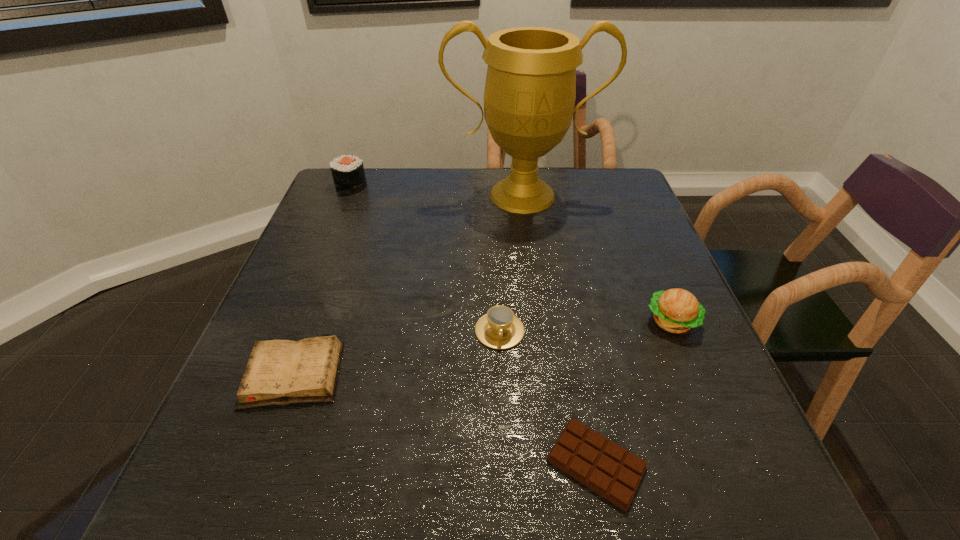
The width and height of the screenshot is (960, 540). I want to click on the tallest object, so click(x=529, y=97).

Locate an element on the screen. The width and height of the screenshot is (960, 540). sushi is located at coordinates (348, 173).

At what (x,y) coordinates should I click in order to perform the action: click on hamburger. Please return your answer as a coordinate pair (x, y). Looking at the image, I should click on (676, 310).

Find the location of a particular element. The height and width of the screenshot is (540, 960). cup is located at coordinates (500, 329).

You are a GUI agent. You are given a task and a screenshot of the screen. Output one action in this format:
    pyautogui.click(x=<x>, y=<y>)
    Task: Click on the diary
    The width and height of the screenshot is (960, 540).
    Given the screenshot: What is the action you would take?
    pyautogui.click(x=279, y=372)

I want to click on candy bar, so click(608, 469).

Image resolution: width=960 pixels, height=540 pixels. Identify the location of the shortest object. (608, 469).

At what (x,y) coordinates should I click in order to perform the action: click on vacant space located on the engravings side of the tallest object. Please return your answer as a coordinate pair (x, y). This screenshot has width=960, height=540. Looking at the image, I should click on (533, 276).

I want to click on vacant point located 0.350m on the front of the sushi, so click(x=316, y=275).

Locate an element on the screen. Image resolution: width=960 pixels, height=540 pixels. free region located 0.160m on the left of the rightmost object is located at coordinates tap(569, 321).